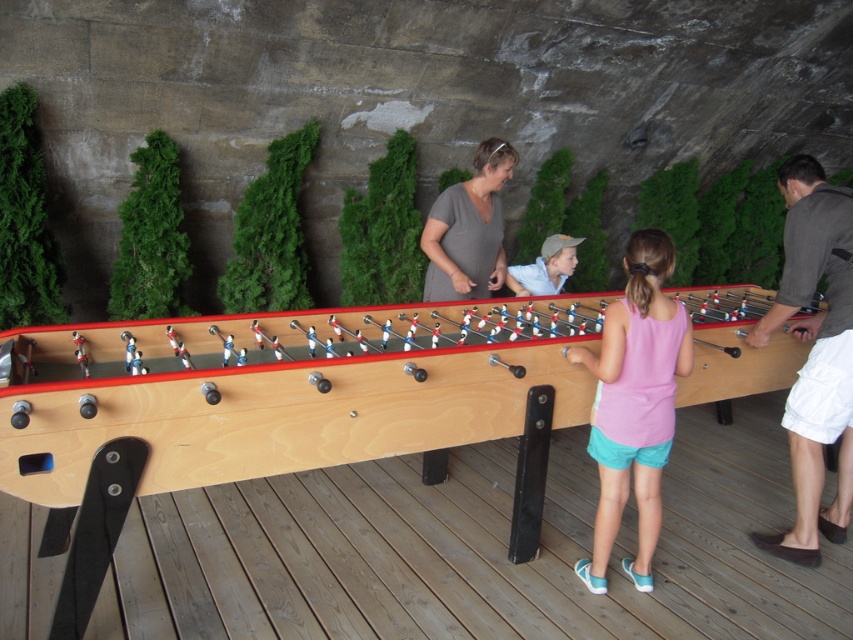
You are observing a foosball game on the wooden table. You notice two players wearing dark gray fabric shirt at right and pink fabric shirt at center. Which player is standing higher in the image?

The dark gray fabric shirt at right is taller than pink fabric shirt at center, so the player wearing the dark gray fabric shirt at right is standing higher in the image.

You are standing at the edge of the wooden deck where the foosball table is located. You notice a point marked at coordinates (814, 353). Which object from the scene is located at this point?

The point at coordinates (814, 353) indicates the location of the dark gray fabric shirt at right.